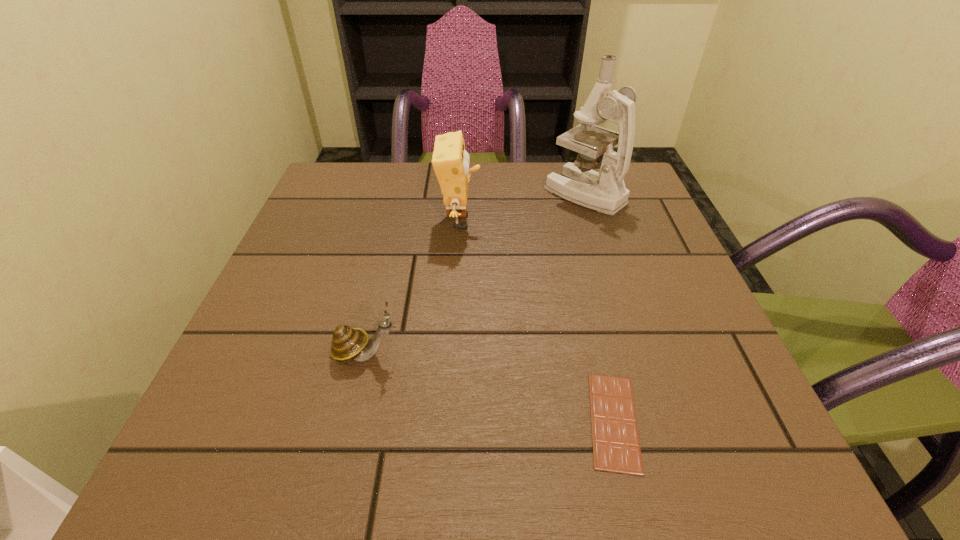
Where is `vacant space located 0.060m on the back of the nearest object`? The height and width of the screenshot is (540, 960). vacant space located 0.060m on the back of the nearest object is located at coordinates (595, 344).

Where is `microscope present at the far edge`? The width and height of the screenshot is (960, 540). microscope present at the far edge is located at coordinates (605, 192).

Where is `sponge at the far edge`? The width and height of the screenshot is (960, 540). sponge at the far edge is located at coordinates (450, 160).

Image resolution: width=960 pixels, height=540 pixels. I want to click on object that is at the near edge, so click(x=616, y=448).

Locate an element on the screen. object at the left edge is located at coordinates (348, 344).

Find the location of a particular element. Image resolution: width=960 pixels, height=540 pixels. object at the right edge is located at coordinates (605, 192).

Identify the location of object that is positioned at the far right corner. This screenshot has width=960, height=540. (605, 192).

At what (x,y) coordinates should I click in order to perform the action: click on vacant point at the far edge. Please return your answer as a coordinate pair (x, y). Looking at the image, I should click on (391, 209).

In the image, there is a desktop. At what (x,y) coordinates should I click in order to perform the action: click on vacant space at the near edge. Please return your answer as a coordinate pair (x, y). This screenshot has width=960, height=540. Looking at the image, I should click on (412, 433).

Find the location of `vacant area at the left edge`. vacant area at the left edge is located at coordinates (340, 219).